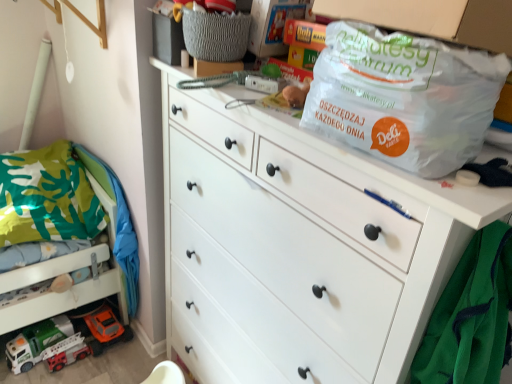
Question: From a real-world perspective, relative to transparent plastic bag at upper right, is gray woven basket at upper center vertically above or below?

Choices:
 (A) above
 (B) below

Answer: (A)

Question: Considering their positions, is gray woven basket at upper center located in front of or behind transparent plastic bag at upper right?

Choices:
 (A) behind
 (B) front

Answer: (A)

Question: Considering the real-world distances, which object is farthest from the gray woven basket at upper center?

Choices:
 (A) green fabric bunk bed at lower left
 (B) transparent plastic bag at upper right
 (C) white matte chest of drawers at center

Answer: (A)

Question: Estimate the real-world distances between objects in this image. Which object is farther from the white matte chest of drawers at center?

Choices:
 (A) green fabric bunk bed at lower left
 (B) transparent plastic bag at upper right
 (C) gray woven basket at upper center

Answer: (A)